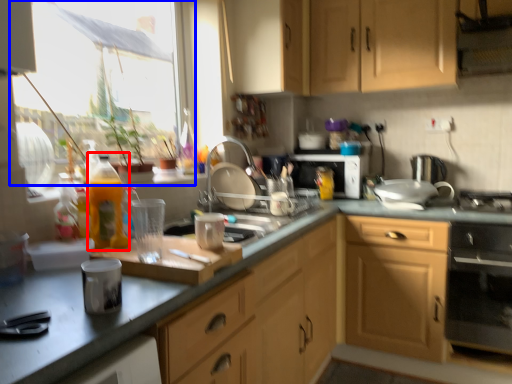
Question: Which object appears closest to the camera in this image, bottle (highlighted by a red box) or window (highlighted by a blue box)?

Choices:
 (A) bottle
 (B) window

Answer: (A)